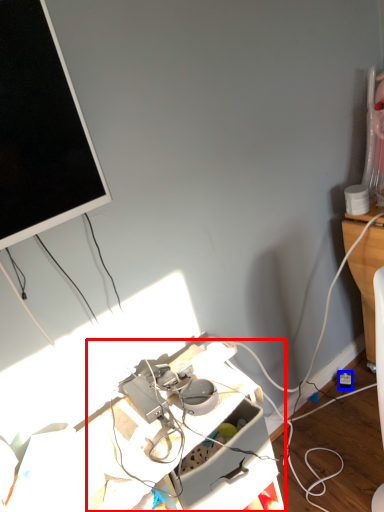
Question: Which object appears farthest to the camera in this image, computer desk (highlighted by a red box) or power outlet (highlighted by a blue box)?

Choices:
 (A) computer desk
 (B) power outlet

Answer: (B)